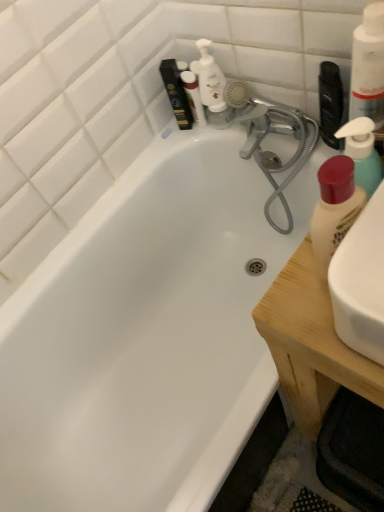
Locate an element on the screen. The width and height of the screenshot is (384, 512). vacant area situated to the left side of white plastic pump bottle at upper center is located at coordinates (170, 141).